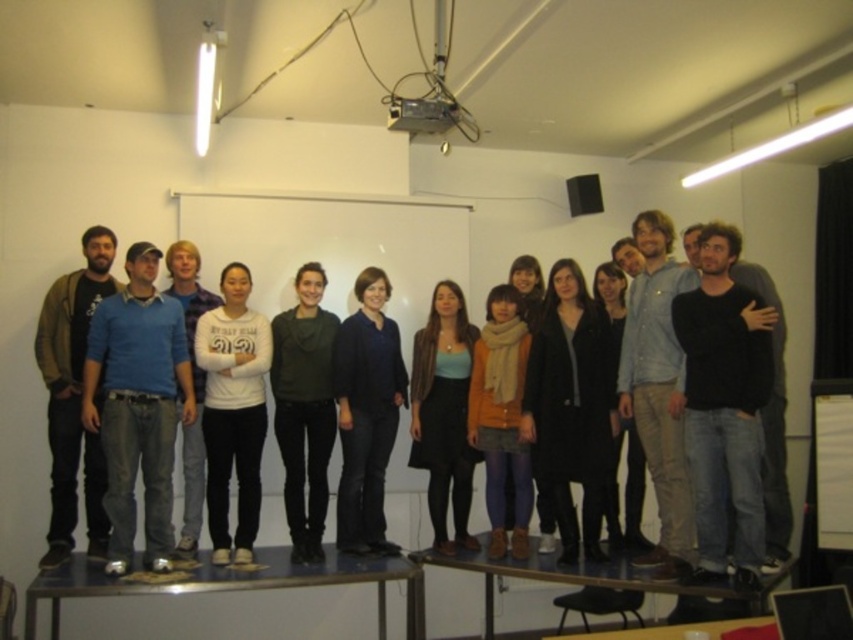
You are a photographer setting up for a group photo. You notice the blue sweater at center and the blue denim shirt at right. Which of these two items is positioned lower in the image?

The blue sweater at center is positioned lower than the blue denim shirt at right.

You are standing in the classroom and want to take a photo of both the point at coordinates (561,506) and the point at coordinates (276,381). Which point should you focus on first to ensure both are in focus?

You should focus on the point at coordinates (276,381) first because it is farther from the camera than the point at coordinates (561,506). This way, both points will be within the depth of field when focused on the farther point.

You are standing in the classroom and want to move from the point at coordinates (152, 467) to the point at coordinates (645, 328). Which direction should you move in to get closer to your destination?

You should move backward because the point at coordinates (152, 467) is closer to you than the point at coordinates (645, 328), so moving backward will take you toward the farther point.